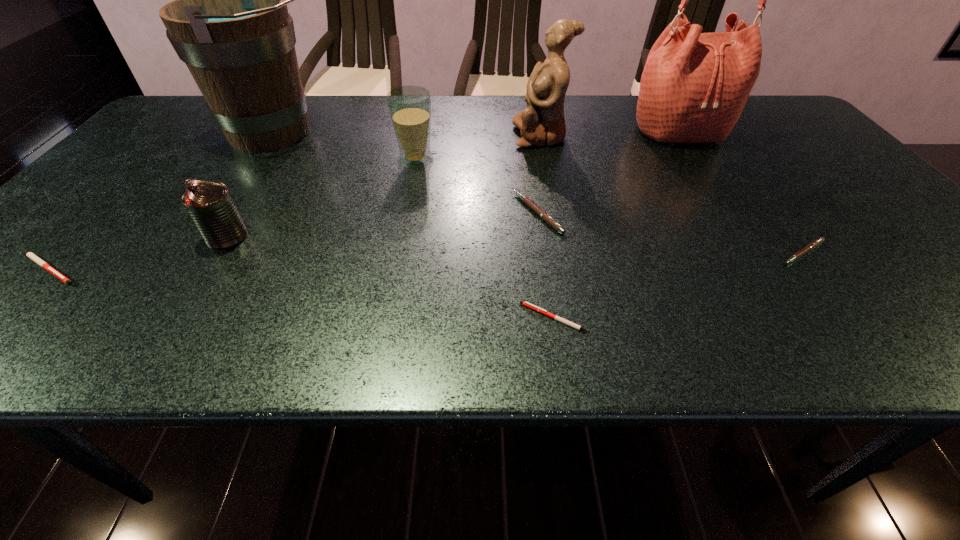
This screenshot has height=540, width=960. I want to click on the rightmost pen, so click(815, 243).

The height and width of the screenshot is (540, 960). Identify the location of the smaller white pen. (529, 305).

Image resolution: width=960 pixels, height=540 pixels. Identify the location of the shortest object. (529, 305).

I want to click on free space located 0.360m on the front of the handbag, so click(x=751, y=240).

The width and height of the screenshot is (960, 540). What are the coordinates of `free space located 0.370m with a handle on the side of the wine bucket` in the screenshot? It's located at (464, 132).

At what (x,y) coordinates should I click in order to perform the action: click on free spot located on the front-facing side of the figurine. Please return your answer as a coordinate pair (x, y). The image size is (960, 540). Looking at the image, I should click on (495, 136).

The image size is (960, 540). What are the coordinates of `free space located on the front-facing side of the figurine` in the screenshot? It's located at (430, 136).

The width and height of the screenshot is (960, 540). I want to click on free space located on the front-facing side of the figurine, so click(x=448, y=136).

This screenshot has height=540, width=960. I want to click on vacant region located on the right of the glass, so click(591, 161).

The width and height of the screenshot is (960, 540). In order to click on free point located on the left of the can in this screenshot , I will do `click(84, 237)`.